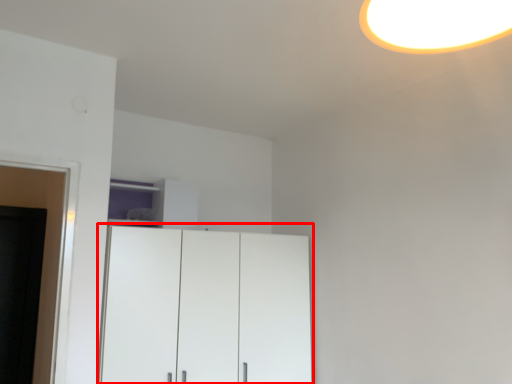
Question: Where is cupboard (annotated by the red box) located in relation to cabinetry in the image?

Choices:
 (A) right
 (B) left

Answer: (A)